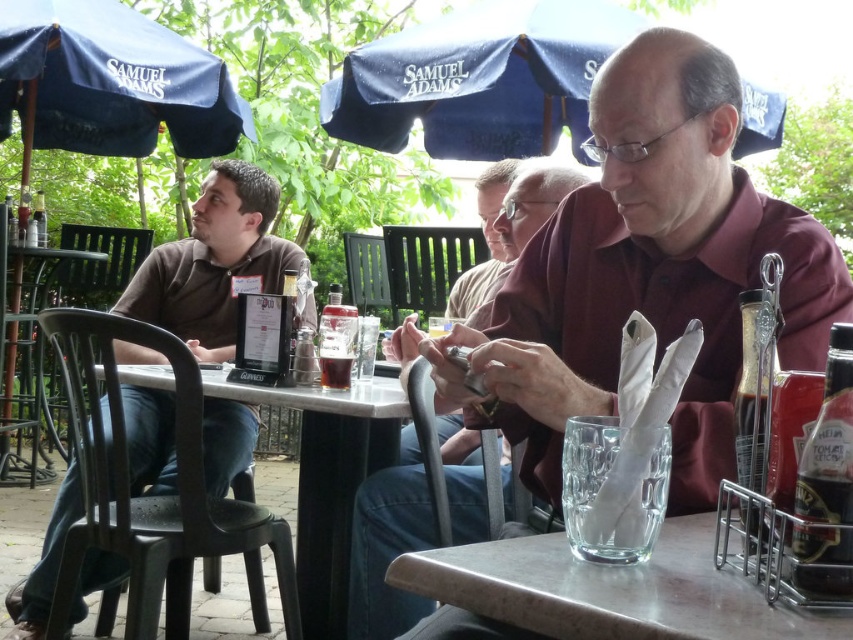
From the picture: You are a waiter at the Samuel Adams pub. You need to place a new drink order on the table for a customer. Where should you place it relative to the clear glass water at lower center and the white plastic table at center?

The clear glass water at lower center is above the white plastic table at center, so you should place the new drink order next to the clear glass water at lower center on the white plastic table at center to ensure it is on the table surface.

You are standing in a pub and want to place a 5 feet long object on the white plastic table at center. Can you do that?

The white plastic table at center and viewer are 4.80 feet apart. The distance between you and the table is less than the length of the object, so placing a 5 feet long object on the white plastic table at center may not be feasible due to space constraints.

You are a photographer setting up a shot of the white plastic table at center and the black plastic chair at left. Which object should you frame first if you want to capture both in a single shot without cropping?

The white plastic table at center is smaller than the black plastic chair at left, so you should frame the larger object first, which is the black plastic chair at left, to ensure both fit in the shot.